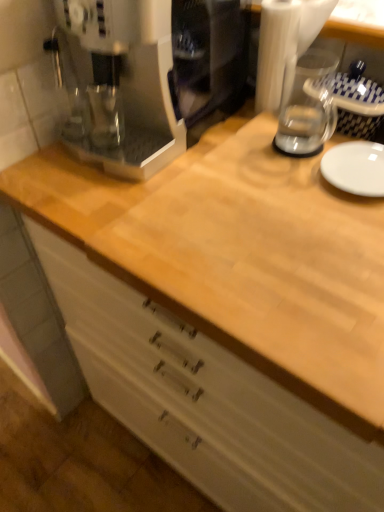
Question: Is natural wood cabinet at center bigger than white glossy plate at right?

Choices:
 (A) no
 (B) yes

Answer: (B)

Question: Does natural wood cabinet at center have a lesser width compared to white glossy plate at right?

Choices:
 (A) yes
 (B) no

Answer: (B)

Question: From the image's perspective, is natural wood cabinet at center below white glossy plate at right?

Choices:
 (A) no
 (B) yes

Answer: (B)

Question: Is natural wood cabinet at center facing away from white glossy plate at right?

Choices:
 (A) no
 (B) yes

Answer: (A)

Question: Does natural wood cabinet at center turn towards white glossy plate at right?

Choices:
 (A) yes
 (B) no

Answer: (B)

Question: Is white glossy plate at right inside natural wood cabinet at center?

Choices:
 (A) no
 (B) yes

Answer: (B)

Question: From the image's perspective, is transparent glass blender at upper right over white glossy plate at right?

Choices:
 (A) no
 (B) yes

Answer: (B)

Question: Is the depth of transparent glass blender at upper right greater than that of white glossy plate at right?

Choices:
 (A) no
 (B) yes

Answer: (A)

Question: Is transparent glass blender at upper right beside white glossy plate at right?

Choices:
 (A) no
 (B) yes

Answer: (A)

Question: Is transparent glass blender at upper right turned away from white glossy plate at right?

Choices:
 (A) yes
 (B) no

Answer: (B)

Question: From a real-world perspective, is transparent glass blender at upper right beneath white glossy plate at right?

Choices:
 (A) yes
 (B) no

Answer: (B)

Question: Considering the relative sizes of transparent glass blender at upper right and white glossy plate at right in the image provided, is transparent glass blender at upper right taller than white glossy plate at right?

Choices:
 (A) yes
 (B) no

Answer: (A)

Question: Is white glossy plate at right touching transparent glass blender at upper right?

Choices:
 (A) no
 (B) yes

Answer: (A)